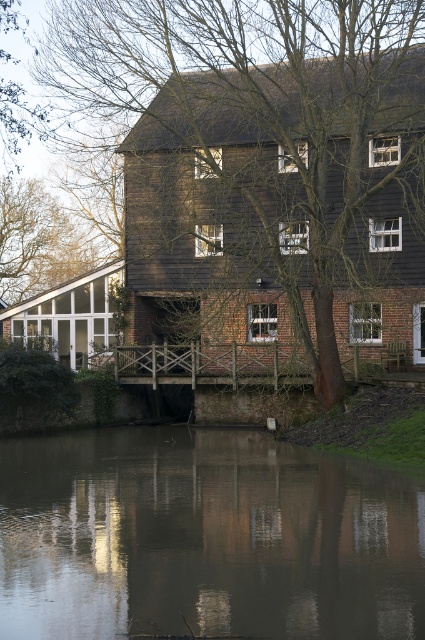
Which is more to the left, murky reflective water at center or brown wood tree at center?

brown wood tree at center is more to the left.

Which is below, murky reflective water at center or brown wood tree at center?

murky reflective water at center

What do you see at coordinates (204, 538) in the screenshot? I see `murky reflective water at center` at bounding box center [204, 538].

Identify the location of murky reflective water at center. (204, 538).